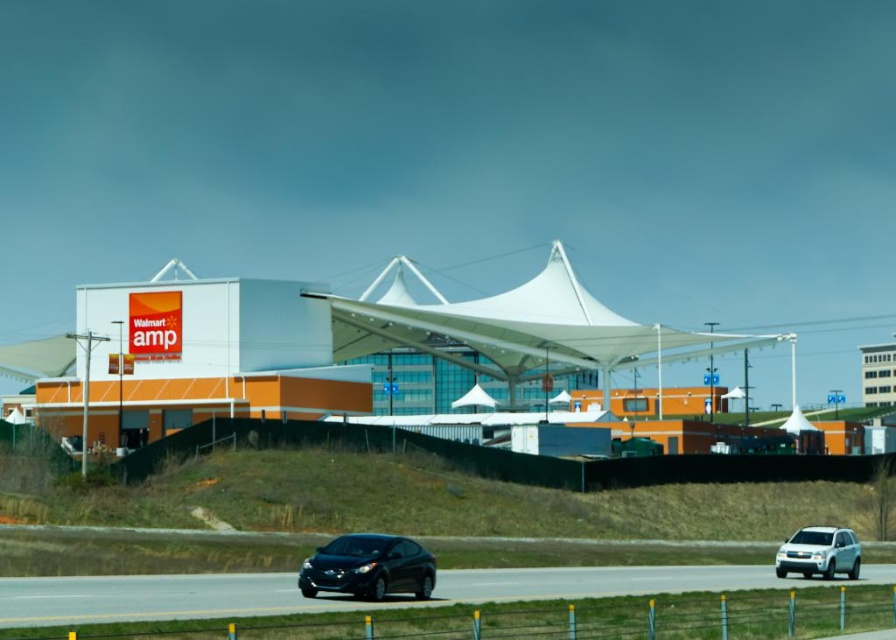
You are standing at the edge of the scene and want to cross the road to reach the Walmart AMP store. The black asphalt highway at lower center is the only road you need to cross. Considering your safety, is the distance of the road from you sufficient to safely cross without any vehicles obstructing your path?

The black asphalt highway at lower center is 24.90 meters away from the viewer. This distance is quite large, so you should ensure there are no oncoming vehicles before attempting to cross safely.

You are a pedestrian standing at the edge of the black asphalt highway at lower center. You see the glossy black car at lower center approaching. Is the car on the highway or above it?

The black asphalt highway at lower center is located below the glossy black car at lower center, so the car is above the highway.